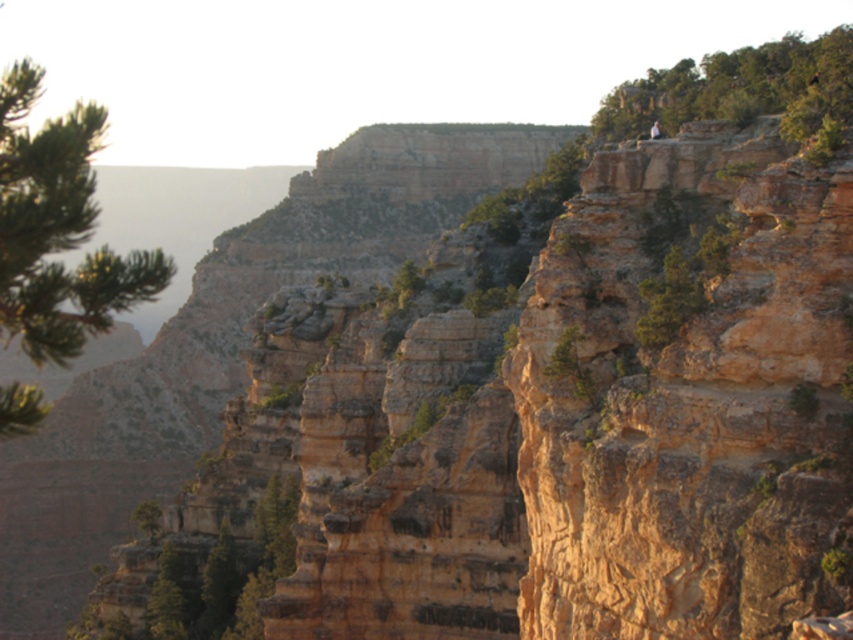
You are planning to plant a new pine tree in the canyon. The existing green textured pine tree at left is located at point (57, 228). If you want to plant the new pine tree 2 meters away from the existing one, what coordinate should you choose?

The new pine tree should be planted at a coordinate 2 meters away from point 0.359, 0.359. However, the exact coordinate depends on the direction chosen, as coordinates alone don

You are a hiker standing at the base of the canyon. You see a green textured pine tree at left and a green leafy tree at upper right. Which tree is closer to your current position?

The green textured pine tree at left is closer to your current position because it is located below the green leafy tree at upper right, indicating it is nearer in the foreground.

You are a hiker who wants to take a photo of both the green textured pine tree at left and the green leafy tree at upper right in the same frame. Based on their heights, which tree should you stand closer to in order to include both in your photo?

The green textured pine tree at left is not as tall as the green leafy tree at upper right, so you should stand closer to the green textured pine tree at left to ensure both trees are visible in the photo.